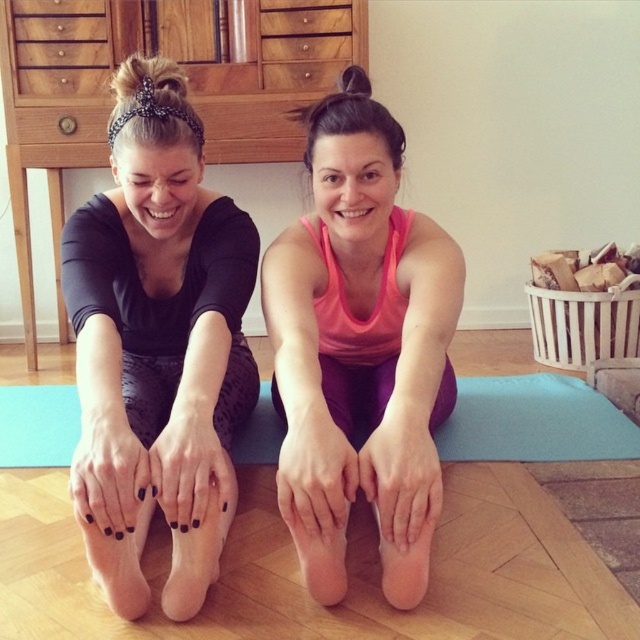
You are standing in the room and see two points marked in the image. Which point is closer to you, point (496, 444) or point (172, 593)?

Point (496, 444) is closer to you than point (172, 593).

You are standing at the camera position and want to pick up the black matte leggings at lower left. Is the distance within your comfortable reach?

The black matte leggings at lower left are 3.31 feet away from the camera, which is within a comfortable reach for most people.

You are a photographer setting up a shoot in the room. You need to ensure that the black matte leggings at lower left and the black matte foot at lower center are both visible in the frame. Given their sizes, which object should you focus on to ensure both are in the shot without needing to adjust the camera angle?

The black matte leggings at lower left is larger in size than the black matte foot at lower center, so focusing on the black matte leggings at lower left would ensure both objects are visible in the frame without adjusting the camera angle.